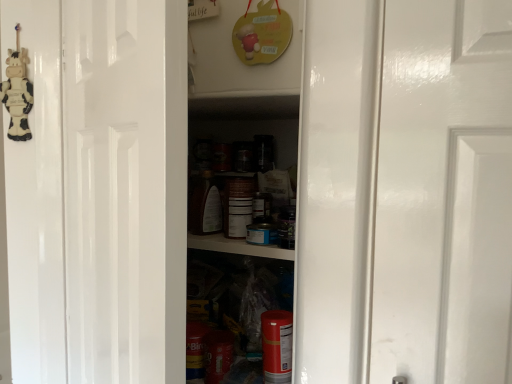
Question: Is cow-patterned plush at left wider or thinner than glossy white door at center?

Choices:
 (A) wide
 (B) thin

Answer: (B)

Question: Which is correct: cow-patterned plush at left is inside glossy white door at center, or outside of it?

Choices:
 (A) outside
 (B) inside

Answer: (A)

Question: Looking at the image, does cow-patterned plush at left seem bigger or smaller compared to glossy white door at center?

Choices:
 (A) small
 (B) big

Answer: (A)

Question: Is glossy white door at center wider or thinner than cow-patterned plush at left?

Choices:
 (A) wide
 (B) thin

Answer: (A)

Question: Considering the positions of glossy white door at center and cow-patterned plush at left in the image, is glossy white door at center bigger or smaller than cow-patterned plush at left?

Choices:
 (A) big
 (B) small

Answer: (A)

Question: Is glossy white door at center to the left or to the right of cow-patterned plush at left in the image?

Choices:
 (A) left
 (B) right

Answer: (B)

Question: Is glossy white door at center inside or outside of cow-patterned plush at left?

Choices:
 (A) outside
 (B) inside

Answer: (A)